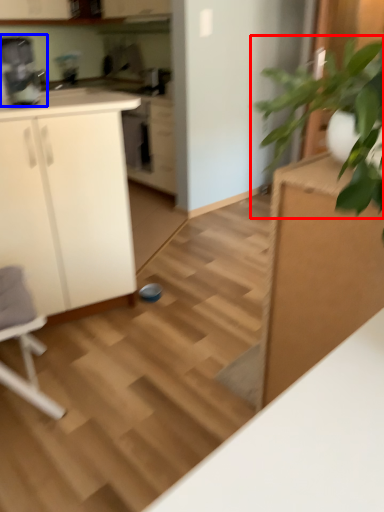
Question: Which object appears closest to the camera in this image, houseplant (highlighted by a red box) or coffee machine (highlighted by a blue box)?

Choices:
 (A) houseplant
 (B) coffee machine

Answer: (A)